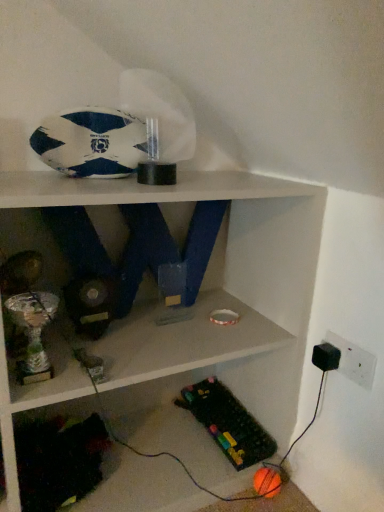
You are a GUI agent. You are given a task and a screenshot of the screen. Output one action in this format:
    pyautogui.click(x=<x>, y=<y>)
    Task: Click on the white and blue textured rugby ball at upper left
    The image size is (384, 512).
    Given the screenshot: What is the action you would take?
    pyautogui.click(x=92, y=143)

Describe the element at coordinates (92, 143) in the screenshot. I see `white and blue textured rugby ball at upper left` at that location.

Identify the location of white and blue textured rugby ball at upper left. (92, 143).